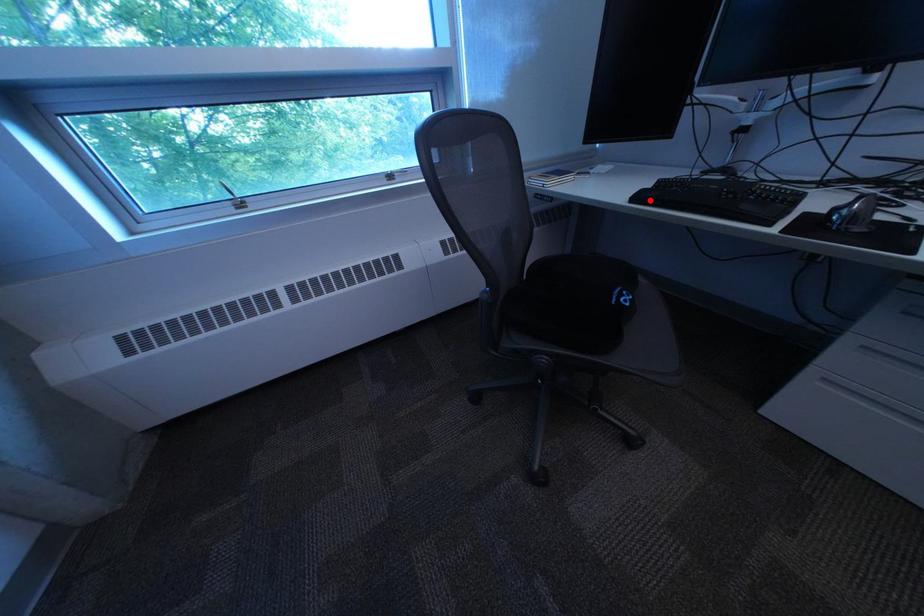
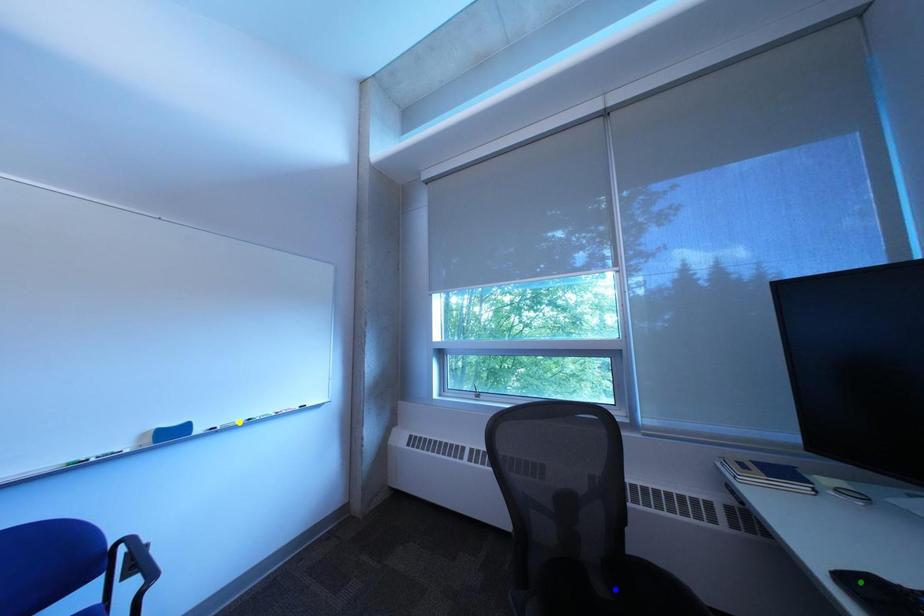
Question: I am providing you with two images of the same scene from different viewpoints. A red point is marked on the first image. You are given multiple points on the second image. Which point in image 2 is actually the same real-world point as the red point in image 1?

Choices:
 (A) blue point
 (B) green point
 (C) yellow point

Answer: (B)